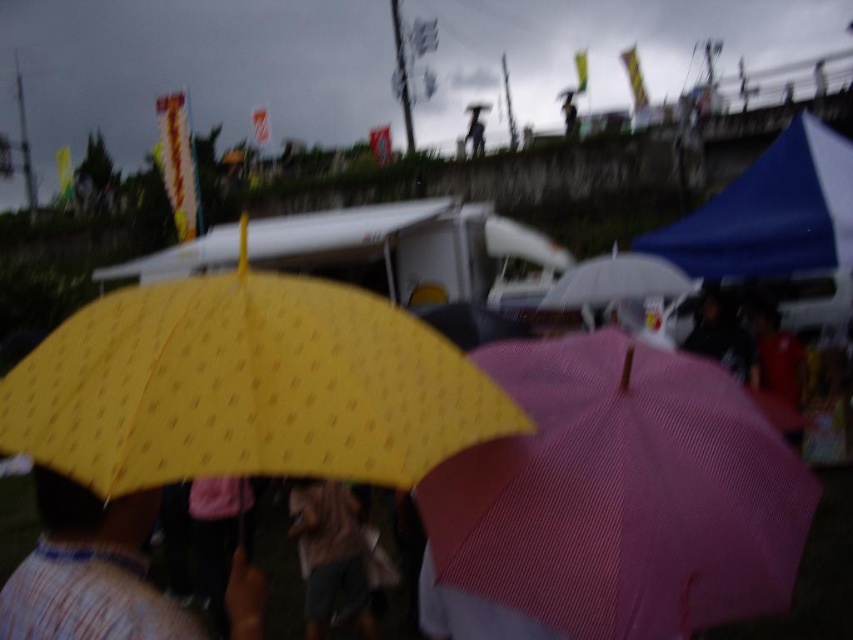
You are standing at the point where the yellow dotted umbrella at center is located, which is represented by point [247,387]. You want to walk towards the pink umbrella with a striped texture. Which direction should you move relative to your current position?

The yellow dotted umbrella at center is located at point [247,387]. To reach the pink umbrella with a striped texture, you should move towards the direction where the pink umbrella is positioned relative to your current location. Since the pink umbrella is in the foreground and the yellow umbrella is at the center, moving towards the foreground direction would lead you to the pink umbrella with a striped texture.

You are attending an outdoor event and see the yellow dotted umbrella at center and the brown fabric umbrella at center. Which one offers more coverage from the rain?

The yellow dotted umbrella at center has a larger size compared to the brown fabric umbrella at center, so it offers more coverage from the rain.